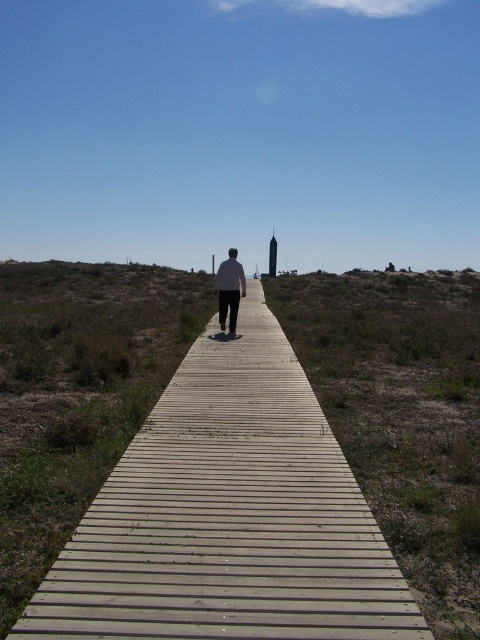
Question: Is wooden planks at center bigger than white matte shirt at center?

Choices:
 (A) yes
 (B) no

Answer: (A)

Question: Can you confirm if wooden planks at center is smaller than white matte shirt at center?

Choices:
 (A) yes
 (B) no

Answer: (B)

Question: Among these points, which one is farthest from the camera?

Choices:
 (A) (232, 316)
 (B) (168, 426)

Answer: (A)

Question: Observing the image, what is the correct spatial positioning of wooden planks at center in reference to white matte shirt at center?

Choices:
 (A) left
 (B) right

Answer: (B)